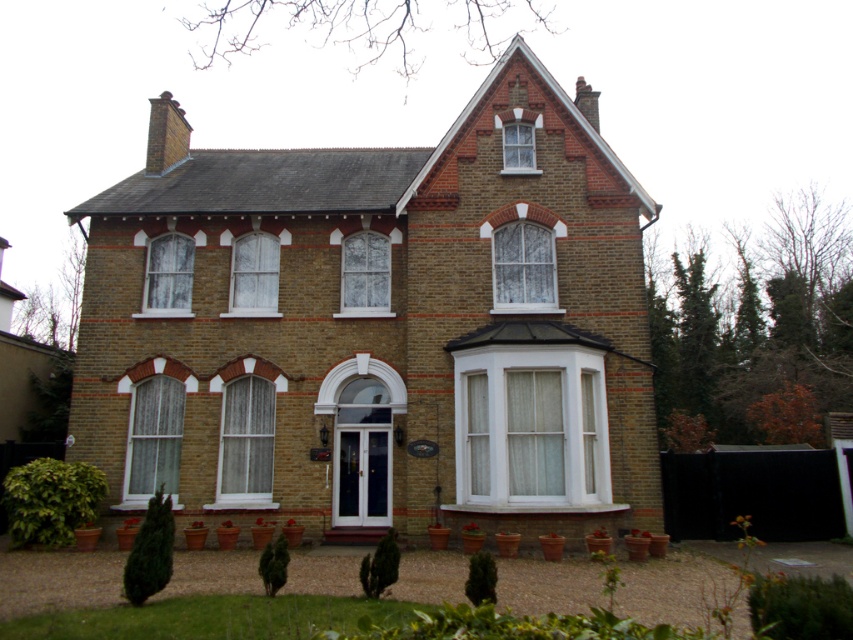
Based on the photo, you are standing in front of the house and looking at the central entrance. There is a point marked at coordinates (523, 266). What is the object located at that point?

The point at coordinates (523, 266) indicates white textured glass at upper center.